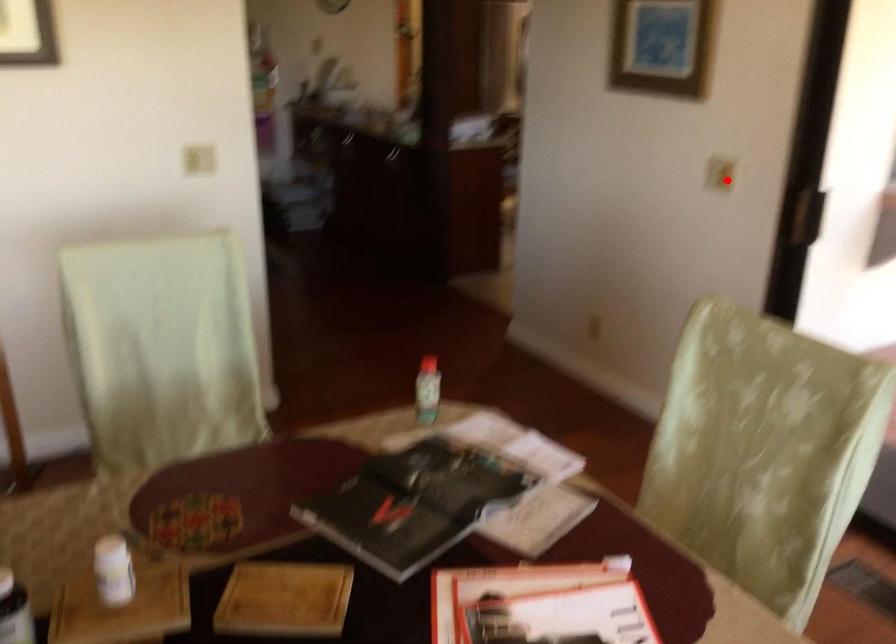
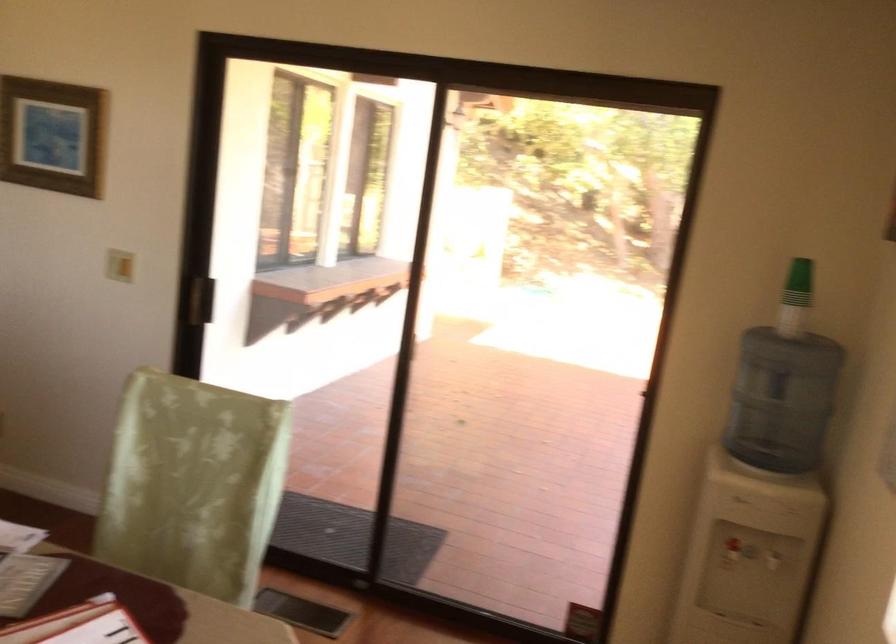
Locate, in the second image, the point that corresponds to the highlighted location in the first image.

(119, 265)